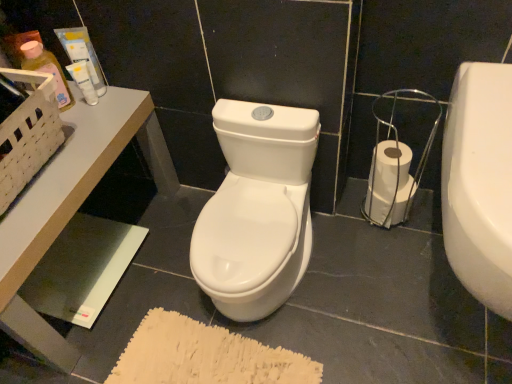
You are a GUI agent. You are given a task and a screenshot of the screen. Output one action in this format:
    pyautogui.click(x=<x>, y=<y>)
    Task: Click on the free space to the right of translucent plastic bottle at upper left, acting as the third toiletry starting from the right
    The image size is (512, 384).
    Given the screenshot: What is the action you would take?
    pyautogui.click(x=110, y=112)